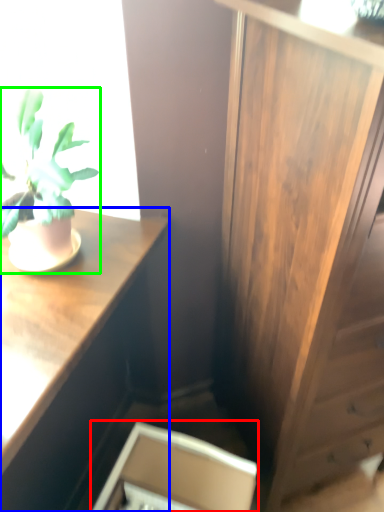
Question: Based on their relative distances, which object is nearer to cabinetry (highlighted by a red box)? Choose from desk (highlighted by a blue box) and houseplant (highlighted by a green box).

Choices:
 (A) desk
 (B) houseplant

Answer: (A)